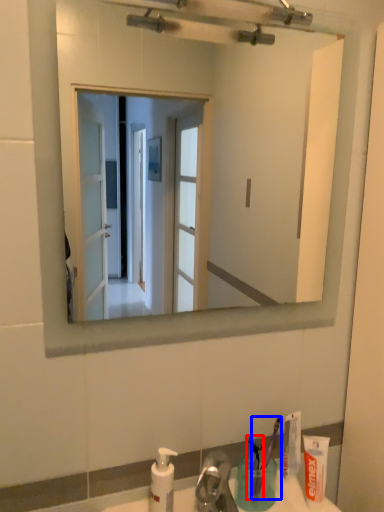
Question: Which object is further to the camera taking this photo, toothbrush (highlighted by a red box) or toothbrush (highlighted by a blue box)?

Choices:
 (A) toothbrush
 (B) toothbrush

Answer: (B)